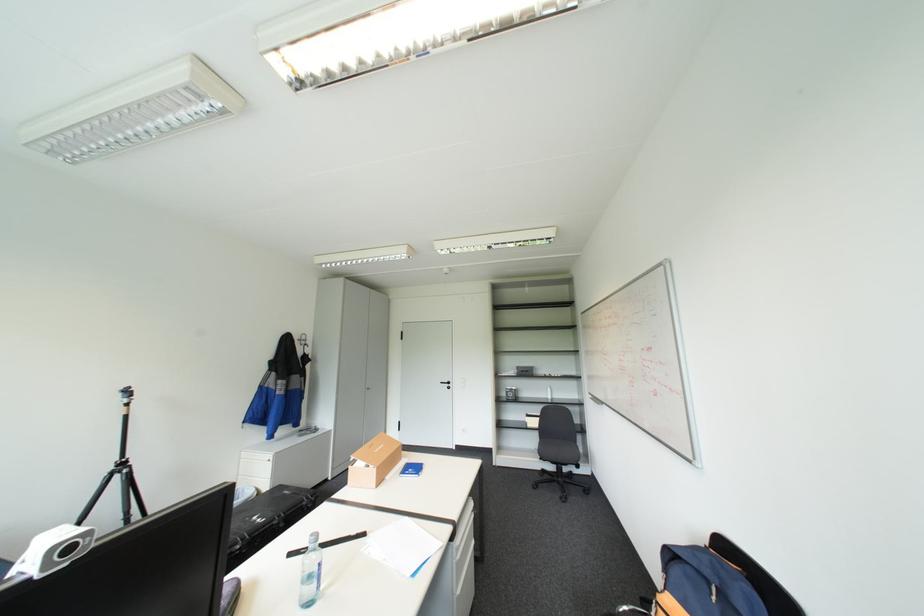
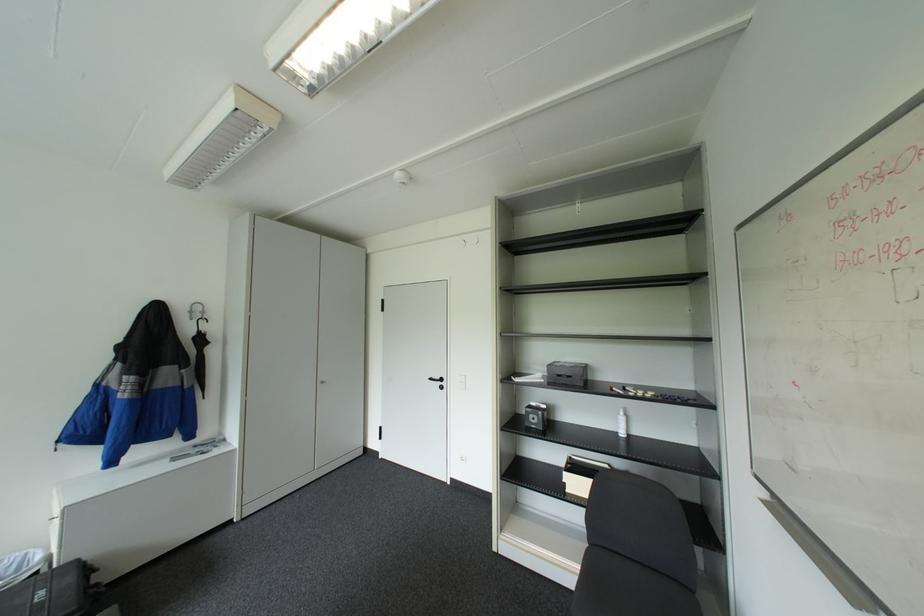
Locate, in the second image, the point that corresponds to (x=450, y=381) in the first image.

(439, 378)